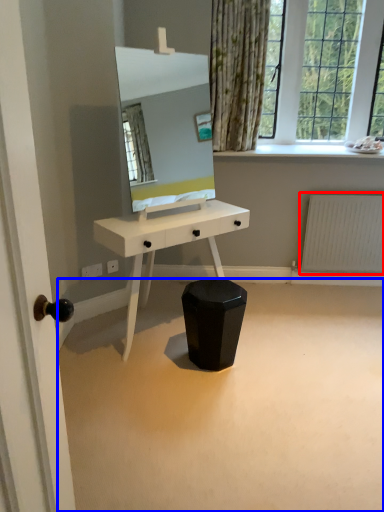
Question: Which object is further to the camera taking this photo, radiator (highlighted by a red box) or plain (highlighted by a blue box)?

Choices:
 (A) radiator
 (B) plain

Answer: (A)